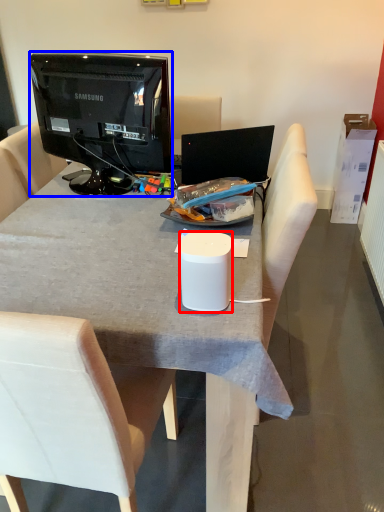
Question: Which object is closer to the camera taking this photo, trash bin/can (highlighted by a red box) or television (highlighted by a blue box)?

Choices:
 (A) trash bin/can
 (B) television

Answer: (A)